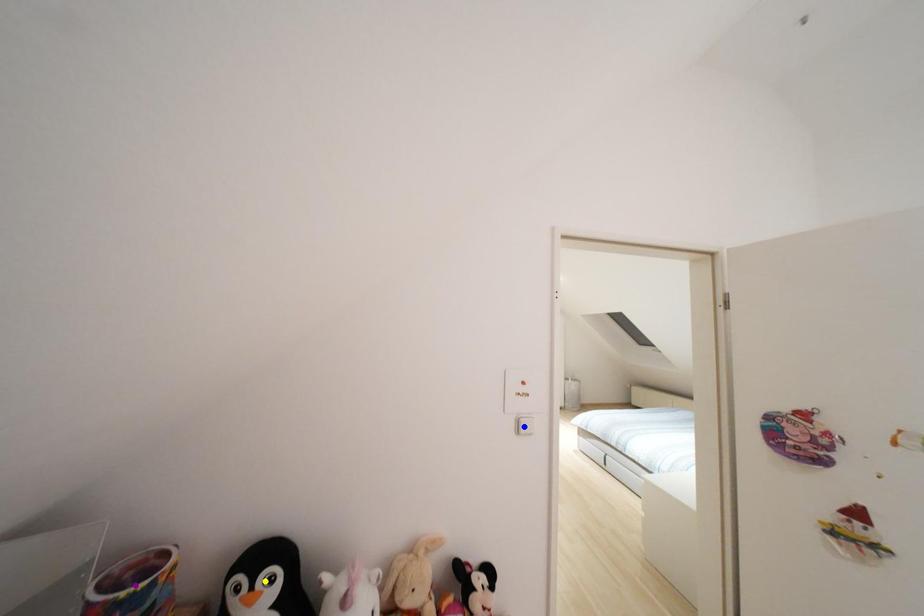
Order these from farthest to nearest:
blue point, purple point, yellow point

blue point
yellow point
purple point